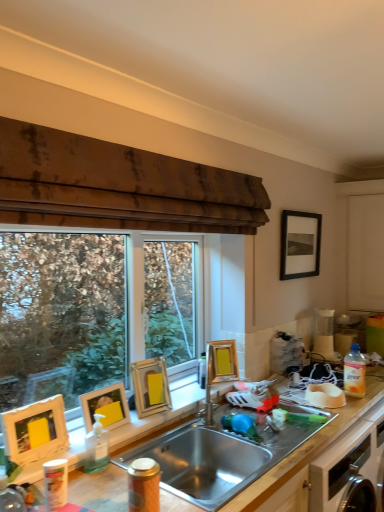
Question: Choose the correct answer: Is white matte cabinet at right inside stainless steel sink at center or outside it?

Choices:
 (A) inside
 (B) outside

Answer: (B)

Question: Considering the positions of white matte cabinet at right and stainless steel sink at center in the image, is white matte cabinet at right bigger or smaller than stainless steel sink at center?

Choices:
 (A) small
 (B) big

Answer: (B)

Question: Which is nearer to the gold metallic picture frame at upper center, the 4th picture frame positioned from the left?

Choices:
 (A) yellow matte picture frame at left, marked as the 4th picture frame in a right-to-left arrangement
 (B) black matte picture frame at upper right, placed as the fifth picture frame when sorted from left to right
 (C) white matte bowl at right
 (D) matte gold picture frame at upper left, arranged as the 3th picture frame when ordered from the bottom
 (E) orange textured canister at sink, marked as the second bottle in a left-to-right arrangement

Answer: (D)

Question: Estimate the real-world distances between objects in this image. Which object is closer to the gold metallic picture frame at upper center, the fourth picture frame from the front?

Choices:
 (A) clear plastic bottle at sink, the 3th bottle in the right-to-left sequence
 (B) stainless steel sink at center
 (C) white matte bowl at right
 (D) matte gold picture frame at upper left, the third picture frame when ordered from back to front
 (E) black matte picture frame at upper right, which is counted as the 5th picture frame, starting from the bottom

Answer: (D)